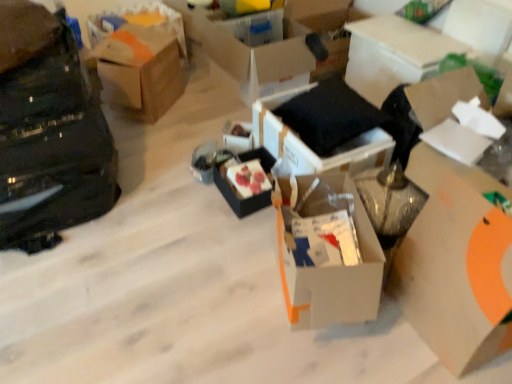
Where is `free area in between brown cardboard box at upper left, positioned as the first box in left-to-right order, and white cardboard box at center, marked as the 2th storage box in a left-to-right arrangement`? The width and height of the screenshot is (512, 384). free area in between brown cardboard box at upper left, positioned as the first box in left-to-right order, and white cardboard box at center, marked as the 2th storage box in a left-to-right arrangement is located at coordinates (190, 118).